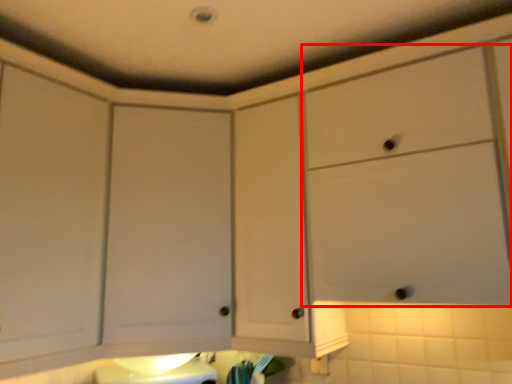
Question: In this image, where is cabinetry (annotated by the red box) located relative to cabinetry?

Choices:
 (A) left
 (B) right

Answer: (B)